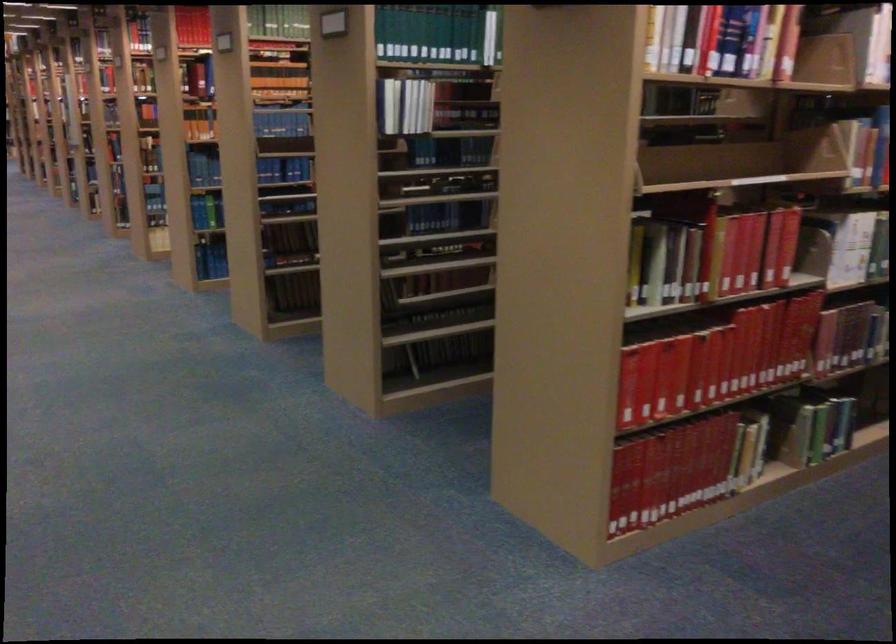
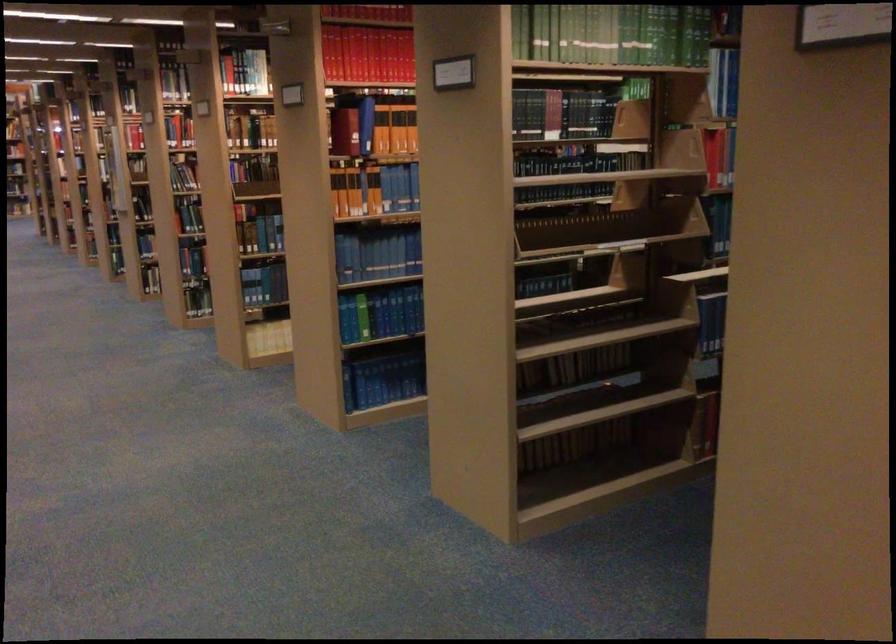
Where in the second image is the point corresponding to point 220,272 from the first image?

(383, 380)